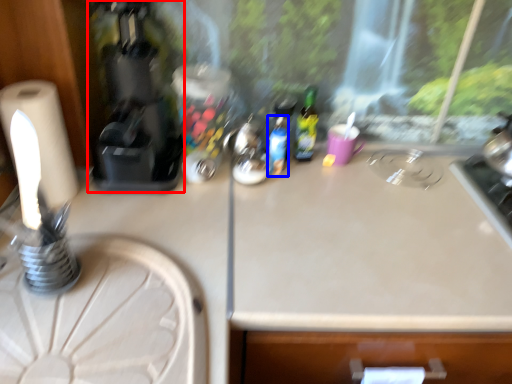
Question: Which object is further to the camera taking this photo, coffee machine (highlighted by a red box) or bottle (highlighted by a blue box)?

Choices:
 (A) coffee machine
 (B) bottle

Answer: (B)